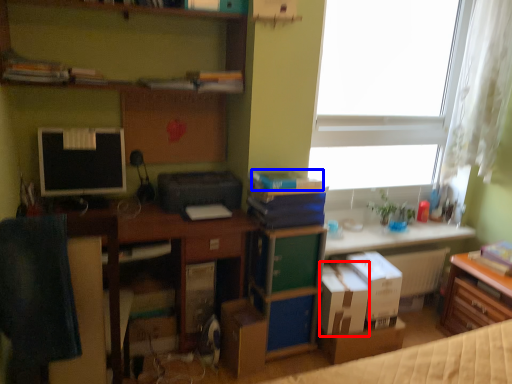
Question: Among these objects, which one is nearest to the camera, cardboard box (highlighted by a red box) or book (highlighted by a blue box)?

Choices:
 (A) cardboard box
 (B) book

Answer: (B)